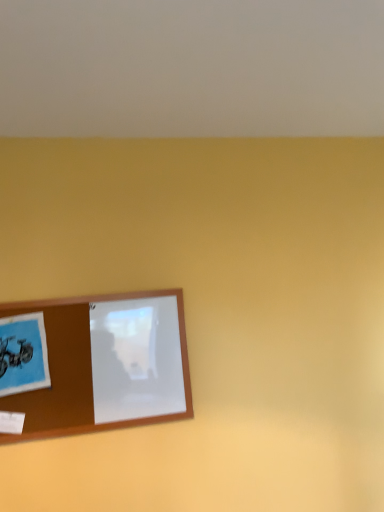
Question: From a real-world perspective, is brown wooden picture frame at lower left on blue matte postcard at lower left?

Choices:
 (A) no
 (B) yes

Answer: (A)

Question: Does brown wooden picture frame at lower left have a larger size compared to blue matte postcard at lower left?

Choices:
 (A) yes
 (B) no

Answer: (A)

Question: Can you confirm if brown wooden picture frame at lower left is smaller than blue matte postcard at lower left?

Choices:
 (A) yes
 (B) no

Answer: (B)

Question: Does brown wooden picture frame at lower left have a lesser width compared to blue matte postcard at lower left?

Choices:
 (A) yes
 (B) no

Answer: (A)

Question: From the image's perspective, is brown wooden picture frame at lower left on top of blue matte postcard at lower left?

Choices:
 (A) no
 (B) yes

Answer: (A)

Question: Is brown wooden picture frame at lower left shorter than blue matte postcard at lower left?

Choices:
 (A) no
 (B) yes

Answer: (A)

Question: Is the position of blue matte postcard at lower left more distant than that of brown wooden picture frame at lower left?

Choices:
 (A) no
 (B) yes

Answer: (A)

Question: Is blue matte postcard at lower left at the right side of brown wooden picture frame at lower left?

Choices:
 (A) no
 (B) yes

Answer: (A)

Question: Is there a large distance between blue matte postcard at lower left and brown wooden picture frame at lower left?

Choices:
 (A) yes
 (B) no

Answer: (B)

Question: Is blue matte postcard at lower left facing towards brown wooden picture frame at lower left?

Choices:
 (A) yes
 (B) no

Answer: (B)

Question: From a real-world perspective, is blue matte postcard at lower left over brown wooden picture frame at lower left?

Choices:
 (A) yes
 (B) no

Answer: (A)

Question: Is blue matte postcard at lower left not within brown wooden picture frame at lower left?

Choices:
 (A) no
 (B) yes

Answer: (A)

Question: Is brown wooden picture frame at lower left wider or thinner than blue matte postcard at lower left?

Choices:
 (A) thin
 (B) wide

Answer: (A)